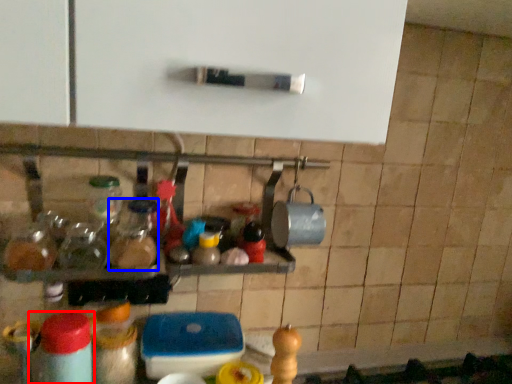
Question: Which object appears farthest to the camera in this image, bottle (highlighted by a red box) or bottle (highlighted by a blue box)?

Choices:
 (A) bottle
 (B) bottle

Answer: (B)